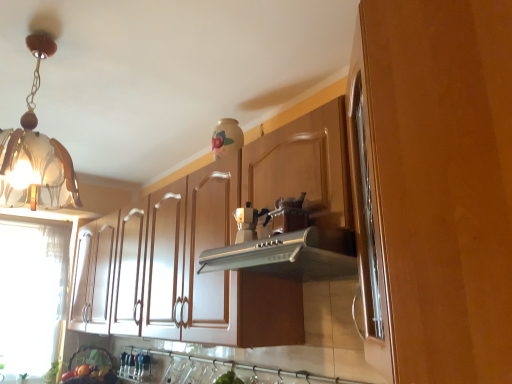
Question: Can you confirm if matte brown cabinet at center, the first cabinetry in the back-to-front sequence, is thinner than matte silver coffee machine at center?

Choices:
 (A) no
 (B) yes

Answer: (A)

Question: From a real-world perspective, is matte brown cabinet at center, the first cabinetry in the back-to-front sequence, below matte silver coffee machine at center?

Choices:
 (A) no
 (B) yes

Answer: (B)

Question: From the image's perspective, is matte brown cabinet at center, the first cabinetry in the back-to-front sequence, beneath matte silver coffee machine at center?

Choices:
 (A) yes
 (B) no

Answer: (A)

Question: Is matte brown cabinet at center, the first cabinetry in the back-to-front sequence, oriented away from matte silver coffee machine at center?

Choices:
 (A) yes
 (B) no

Answer: (A)

Question: Does matte brown cabinet at center, the first cabinetry in the back-to-front sequence, have a smaller size compared to matte silver coffee machine at center?

Choices:
 (A) no
 (B) yes

Answer: (A)

Question: Does point (45, 180) appear closer or farther from the camera than point (240, 251)?

Choices:
 (A) closer
 (B) farther

Answer: (B)

Question: In the image, is translucent glass pendant light at upper left positioned in front of or behind silver metallic vent at center?

Choices:
 (A) front
 (B) behind

Answer: (B)

Question: From the image's perspective, is translucent glass pendant light at upper left positioned above or below silver metallic vent at center?

Choices:
 (A) below
 (B) above

Answer: (B)

Question: From a real-world perspective, is translucent glass pendant light at upper left above or below silver metallic vent at center?

Choices:
 (A) below
 (B) above

Answer: (B)

Question: From a real-world perspective, relative to silver metallic vent at center, is wooden cabinet at center, the second cabinetry viewed from the back, vertically above or below?

Choices:
 (A) below
 (B) above

Answer: (B)

Question: Is point (376, 211) positioned closer to the camera than point (301, 244)?

Choices:
 (A) closer
 (B) farther

Answer: (A)

Question: In terms of size, does wooden cabinet at center, the second cabinetry viewed from the back, appear bigger or smaller than silver metallic vent at center?

Choices:
 (A) big
 (B) small

Answer: (A)

Question: Is wooden cabinet at center, marked as the 1th cabinetry in a front-to-back arrangement, situated inside silver metallic vent at center or outside?

Choices:
 (A) outside
 (B) inside

Answer: (A)

Question: In terms of height, does wooden cabinet at center, the second cabinetry viewed from the back, look taller or shorter compared to translucent glass pendant light at upper left?

Choices:
 (A) tall
 (B) short

Answer: (A)

Question: Is wooden cabinet at center, the second cabinetry viewed from the back, in front of or behind translucent glass pendant light at upper left in the image?

Choices:
 (A) front
 (B) behind

Answer: (A)